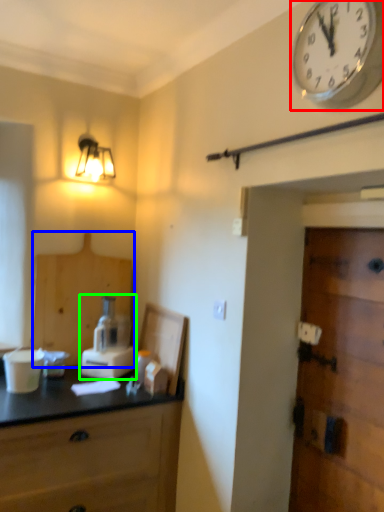
Question: Which object is positioned closest to wall clock (highlighted by a red box)? Select from cabinetry (highlighted by a blue box) and blender (highlighted by a green box).

Choices:
 (A) cabinetry
 (B) blender

Answer: (B)